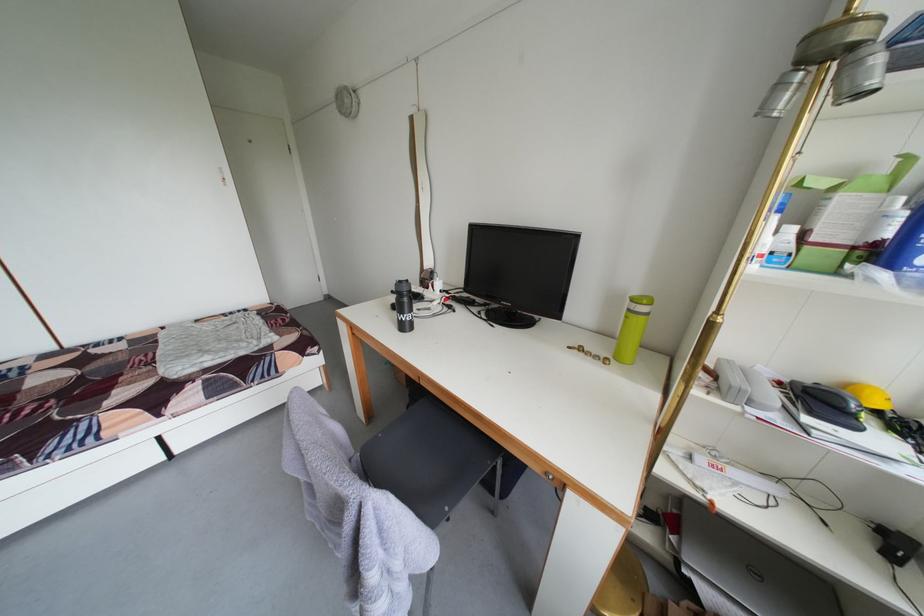
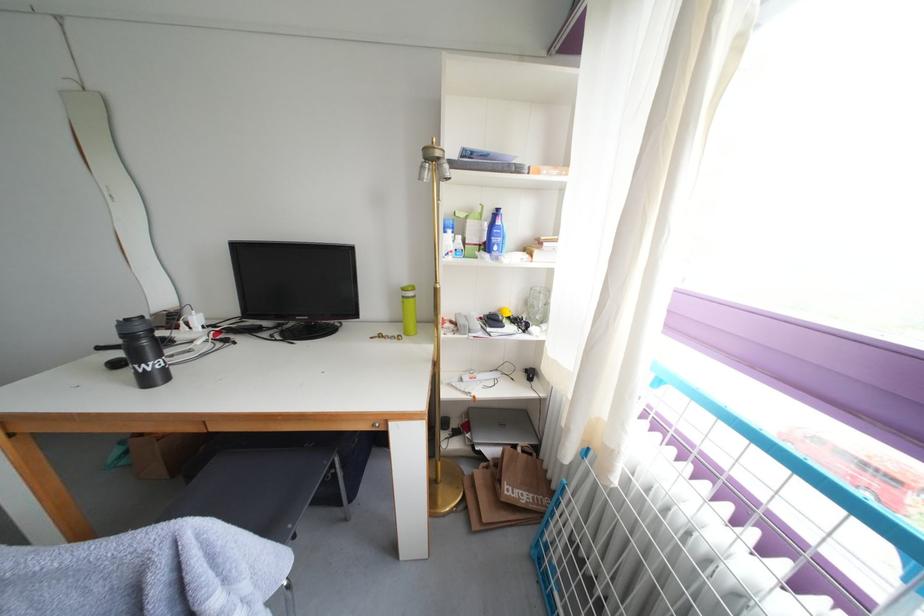
Locate, in the second image, the point that corresponds to pixel 415 294 in the first image.

(150, 334)